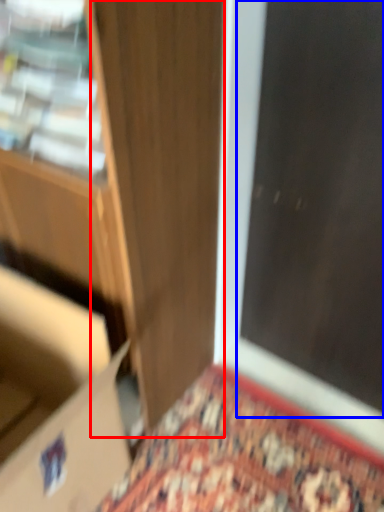
Question: Among these objects, which one is farthest to the camera, door (highlighted by a red box) or screen door (highlighted by a blue box)?

Choices:
 (A) door
 (B) screen door

Answer: (B)